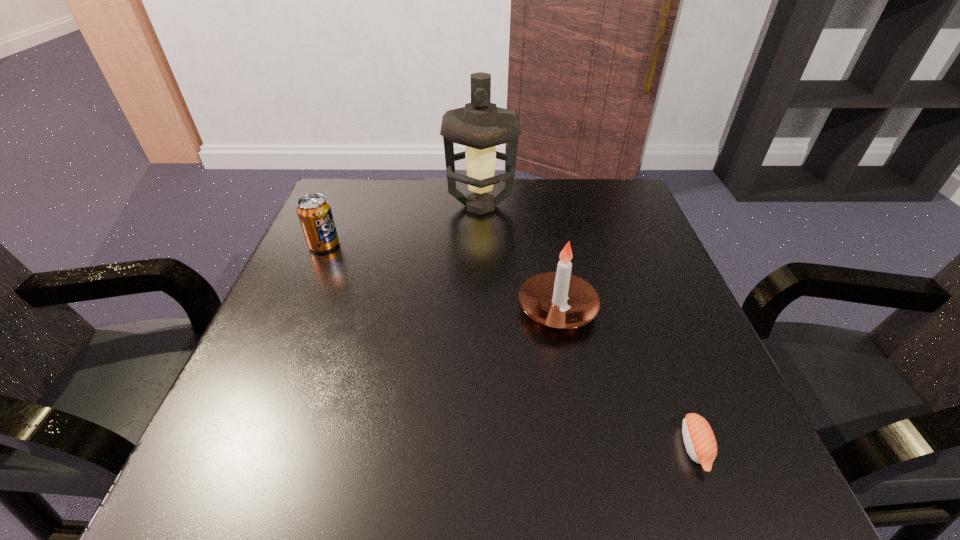
Identify the location of vacant region located 0.390m on the front of the third nearest object. The width and height of the screenshot is (960, 540). (255, 406).

Image resolution: width=960 pixels, height=540 pixels. Find the location of `free space located 0.190m on the back of the shortest object`. free space located 0.190m on the back of the shortest object is located at coordinates (651, 329).

Locate an element on the screen. The image size is (960, 540). object that is positioned at the far edge is located at coordinates click(x=480, y=126).

Identify the location of object at the near edge. (699, 439).

At what (x,y) coordinates should I click in order to perform the action: click on object at the left edge. Please return your answer as a coordinate pair (x, y). The height and width of the screenshot is (540, 960). Looking at the image, I should click on point(314,212).

Image resolution: width=960 pixels, height=540 pixels. Identify the location of object present at the right edge. (699, 439).

I want to click on object that is at the near right corner, so click(x=699, y=439).

This screenshot has width=960, height=540. In the image, there is a desktop. In order to click on vacant area at the far edge in this screenshot , I will do `click(398, 218)`.

You are a GUI agent. You are given a task and a screenshot of the screen. Output one action in this format:
    pyautogui.click(x=<x>, y=<y>)
    Task: Click on the vacant area at the near edge
    The height and width of the screenshot is (540, 960).
    Given the screenshot: What is the action you would take?
    pyautogui.click(x=612, y=501)

This screenshot has height=540, width=960. Find the location of `free location at the left edge`. free location at the left edge is located at coordinates (300, 320).